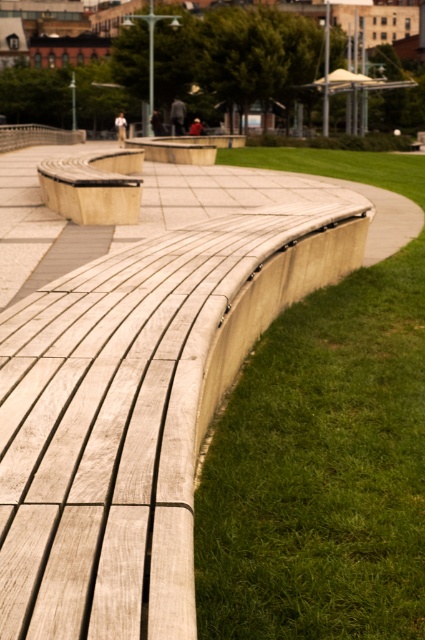
Question: Does green grass at lower right lie in front of wooden bench at center?

Choices:
 (A) yes
 (B) no

Answer: (A)

Question: Does green grass at lower right come in front of wooden bench at center?

Choices:
 (A) no
 (B) yes

Answer: (B)

Question: In this image, where is green grass at lower right located relative to wooden bench at center?

Choices:
 (A) left
 (B) right

Answer: (B)

Question: Among these points, which one is farthest from the camera?

Choices:
 (A) (59, 177)
 (B) (413, 627)

Answer: (A)